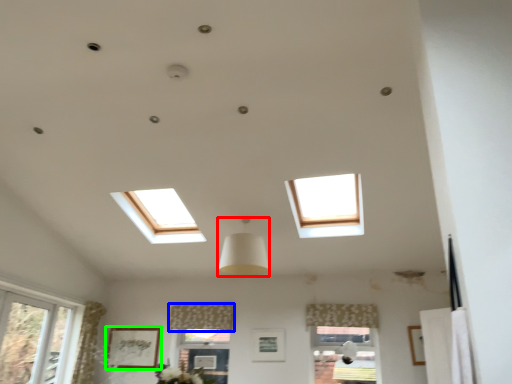
Question: Which is nearer to the lamp (highlighted by a red box)? curtain (highlighted by a blue box) or picture frame (highlighted by a green box).

Choices:
 (A) curtain
 (B) picture frame

Answer: (A)